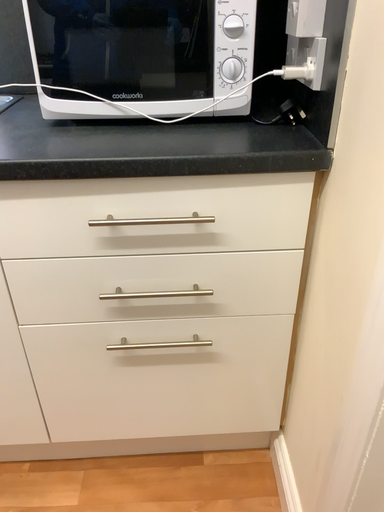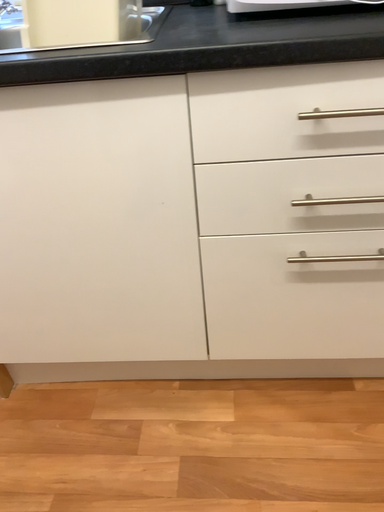
Question: How did the camera likely rotate when shooting the video?

Choices:
 (A) rotated left
 (B) rotated right

Answer: (A)